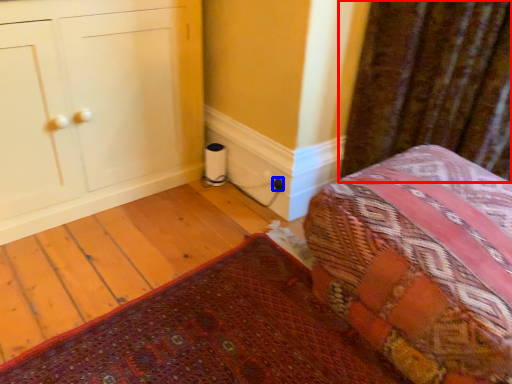
Question: Among these objects, which one is nearest to the camera, curtain (highlighted by a red box) or electric outlet (highlighted by a blue box)?

Choices:
 (A) curtain
 (B) electric outlet

Answer: (A)